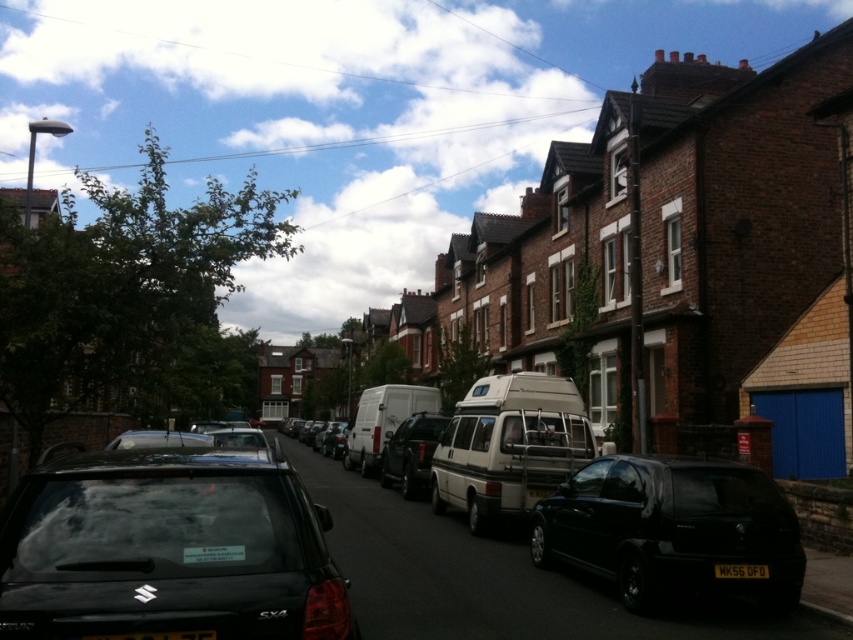
You are a delivery driver needing to park your 5.5 meter long truck between the beige metallic van at center and the white matte van at center. Can you fit your truck in the space between them?

The distance between the beige metallic van at center and the white matte van at center is 9.46 meters. Since your truck is 5.5 meters long, there is sufficient space to park between them as 9.46 meters is greater than 5.5 meters.

You are a delivery driver who needs to park your truck between the white matte van at center and the shiny black car at center. Can you fit your truck, which is 5 meters long, in the space between them?

The space between the white matte van at center and the shiny black car at center is determined by their sizes. Since the white matte van at center is bigger than the shiny black car at center, the distance between them might be sufficient. However, without exact measurements, it is uncertain if the 5 meter truck will fit. Please check the actual space before attempting to park.